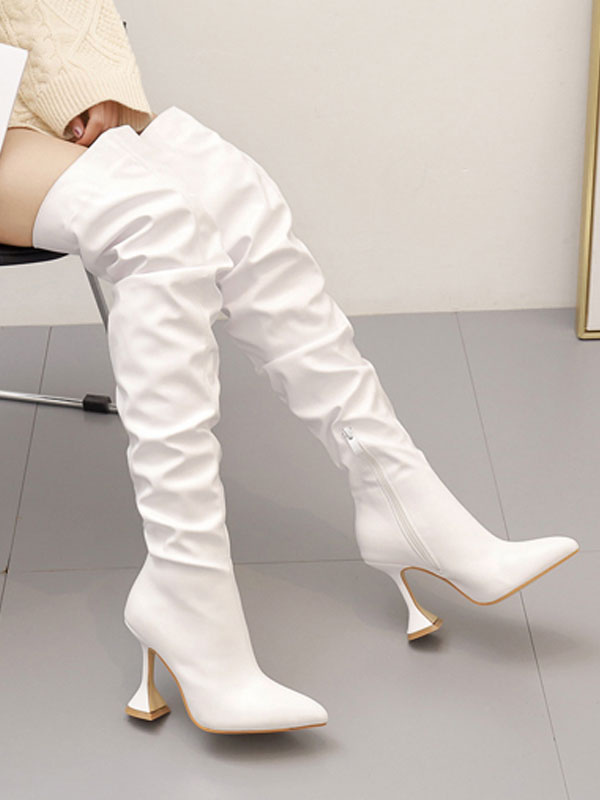
At what (x,y) coordinates should I click in order to perform the action: click on gold frame. Please return your answer as a coordinate pair (x, y). The width and height of the screenshot is (600, 800). Looking at the image, I should click on (582, 318).